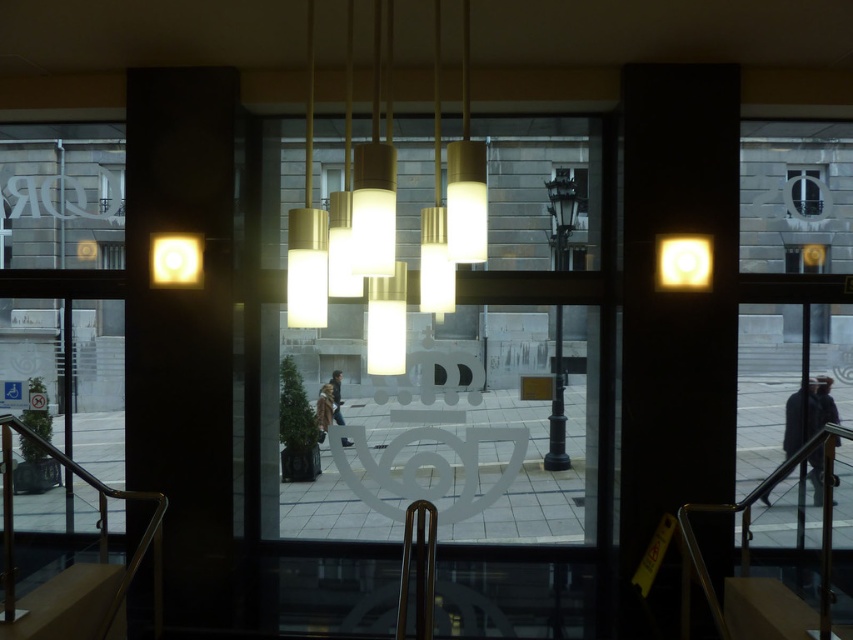
Question: Among these points, which one is farthest from the camera?

Choices:
 (A) (379, 204)
 (B) (578, 140)

Answer: (B)

Question: Does matte gold chandelier at center come behind matte white light at upper right?

Choices:
 (A) yes
 (B) no

Answer: (B)

Question: Which of the following is the closest to the observer?

Choices:
 (A) matte gold chandelier at center
 (B) matte white light at upper right

Answer: (A)

Question: Is matte white light at upper right smaller than matte yellow light at upper left?

Choices:
 (A) yes
 (B) no

Answer: (B)

Question: Estimate the real-world distances between objects in this image. Which object is farther from the translucent glass window at center?

Choices:
 (A) matte white light at upper right
 (B) matte gold chandelier at center

Answer: (B)

Question: Does translucent glass window at center have a lesser width compared to matte gold chandelier at center?

Choices:
 (A) yes
 (B) no

Answer: (B)